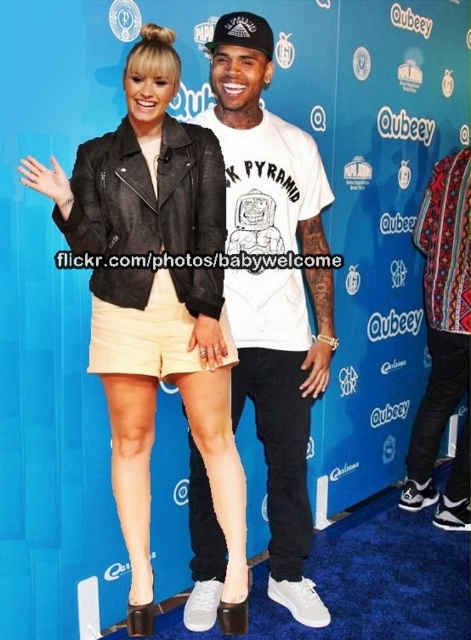
Can you confirm if white cotton t-shirt at center is positioned to the left of patterned fabric jacket at right?

Correct, you'll find white cotton t-shirt at center to the left of patterned fabric jacket at right.

Measure the distance between point (270, 432) and camera.

The distance of point (270, 432) from camera is 2.38 meters.

Locate an element on the screen. white cotton t-shirt at center is located at coordinates (283, 406).

Measure the distance between point (130, 196) and camera.

A distance of 1.92 meters exists between point (130, 196) and camera.

Which is more to the right, black leather jacket at center or white cotton t-shirt at center?

white cotton t-shirt at center is more to the right.

The height and width of the screenshot is (640, 471). Identify the location of black leather jacket at center. (155, 304).

Does black leather jacket at center come in front of patterned fabric jacket at right?

That is True.

Does black leather jacket at center have a larger size compared to patterned fabric jacket at right?

Yes.

Image resolution: width=471 pixels, height=640 pixels. What do you see at coordinates (155, 304) in the screenshot? I see `black leather jacket at center` at bounding box center [155, 304].

Where is `black leather jacket at center`? black leather jacket at center is located at coordinates (155, 304).